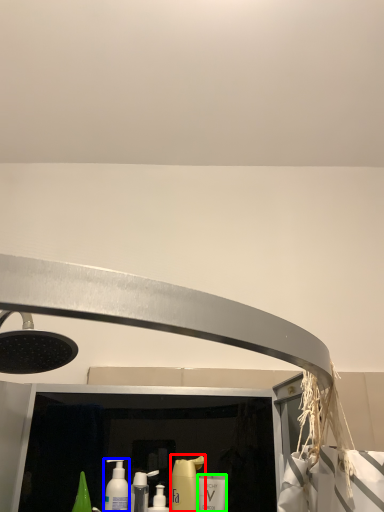
Question: Which is farther away from cleaning product (highlighted by a red box)? mouthwash (highlighted by a blue box) or mouthwash (highlighted by a green box)?

Choices:
 (A) mouthwash
 (B) mouthwash

Answer: (A)